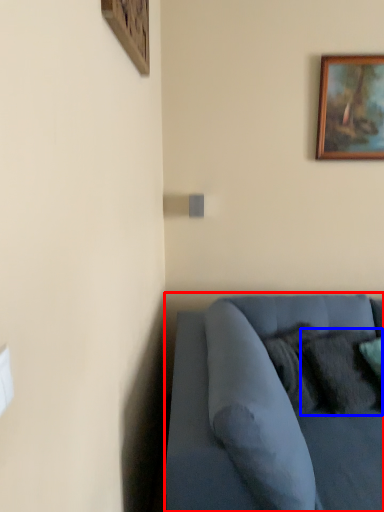
Question: Which of the following is the closest to the observer, studio couch (highlighted by a red box) or pillow (highlighted by a blue box)?

Choices:
 (A) studio couch
 (B) pillow

Answer: (A)